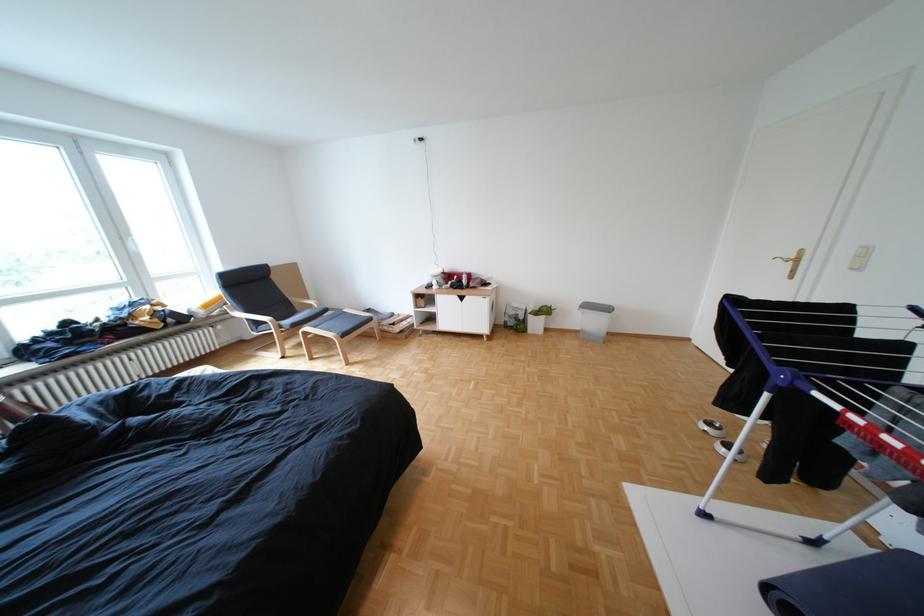
What do you see at coordinates (596, 306) in the screenshot? This screenshot has height=616, width=924. I see `the trash can lid` at bounding box center [596, 306].